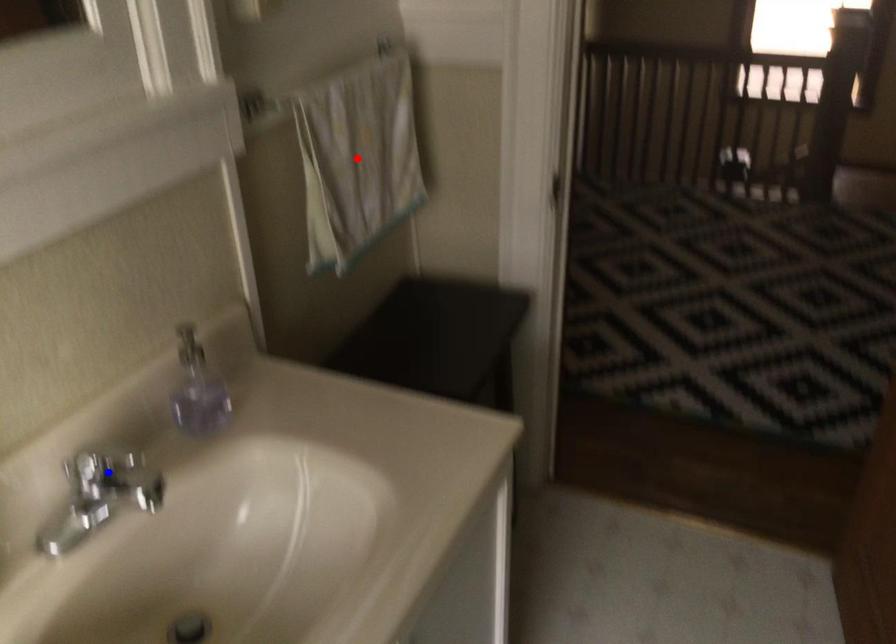
Question: In the image, two points are highlighted. Which point is nearer to the camera? Reply with the corresponding letter.

Choices:
 (A) blue point
 (B) red point

Answer: (A)